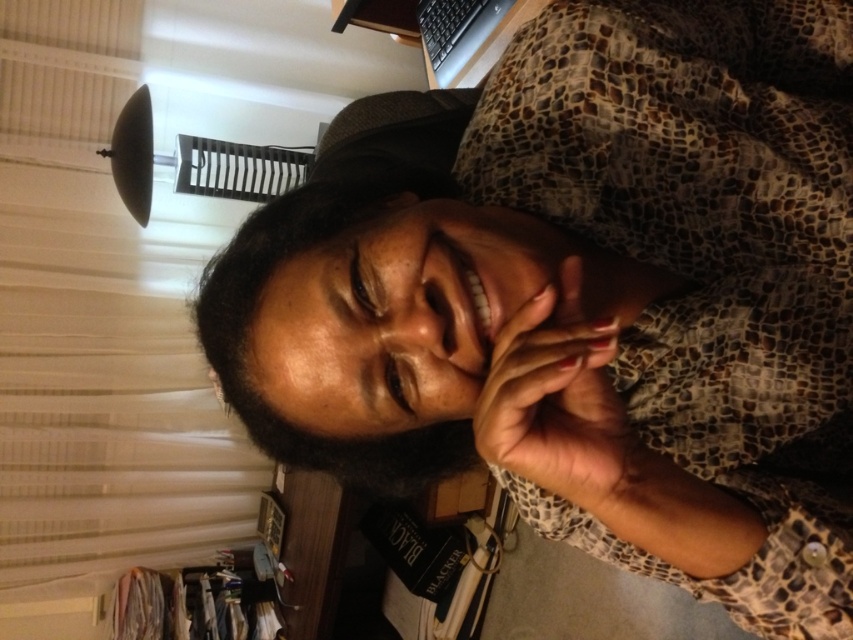
Can you confirm if smooth skin face at center is bigger than nail polish at center?

Yes, smooth skin face at center is bigger than nail polish at center.

Which is in front, point (293, 308) or point (508, 378)?

Point (508, 378) is in front.

Identify the location of smooth skin face at center. The height and width of the screenshot is (640, 853). (397, 316).

Does nail polish at center appear on the left side of black plastic keyboard at upper right?

Incorrect, nail polish at center is not on the left side of black plastic keyboard at upper right.

Who is positioned more to the right, nail polish at center or black plastic keyboard at upper right?

Positioned to the right is nail polish at center.

Is point (572, 384) less distant than point (431, 3)?

Yes, point (572, 384) is in front of point (431, 3).

Locate an element on the screen. nail polish at center is located at coordinates (560, 403).

Does smooth skin face at center have a lesser width compared to black plastic keyboard at upper right?

In fact, smooth skin face at center might be wider than black plastic keyboard at upper right.

Is point (271, 371) more distant than point (474, 58)?

No, it is in front of (474, 58).

Does point (370, 275) come farther from viewer compared to point (440, 13)?

No, it is not.

This screenshot has height=640, width=853. I want to click on smooth skin face at center, so click(397, 316).